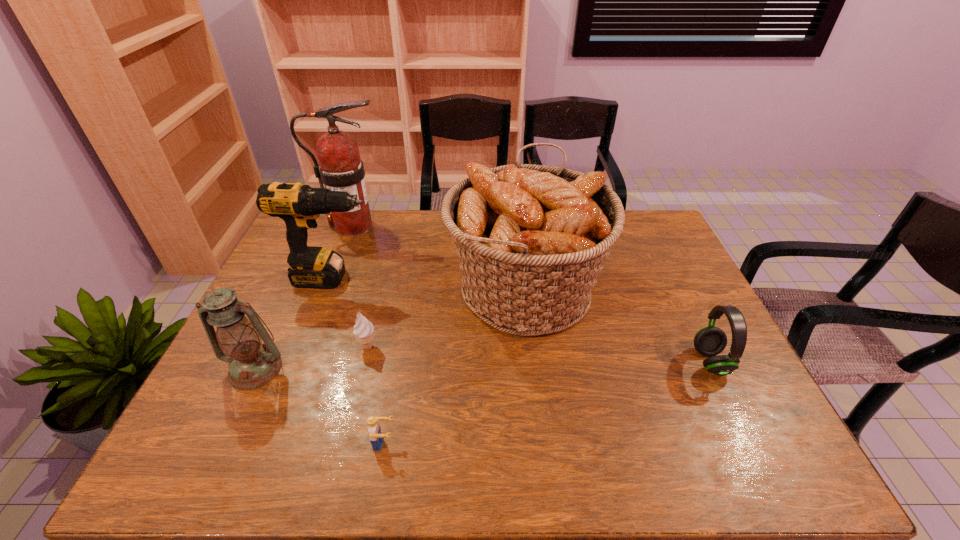
In order to click on basket at the far edge in this screenshot , I will do `click(531, 239)`.

Where is `object at the near edge`? object at the near edge is located at coordinates (376, 437).

Where is `fire extinguisher at the left edge`? The width and height of the screenshot is (960, 540). fire extinguisher at the left edge is located at coordinates (340, 168).

At what (x,y) coordinates should I click in order to perform the action: click on drill that is at the left edge. Please return your answer as a coordinate pair (x, y). Looking at the image, I should click on (299, 206).

Find the location of a particular element. oil lamp positioned at the left edge is located at coordinates (252, 364).

I want to click on object that is at the right edge, so click(710, 341).

Locate an element on the screen. Image resolution: width=960 pixels, height=540 pixels. object that is positioned at the far left corner is located at coordinates (340, 168).

Find the location of `free spot at the near edge of the desktop`. free spot at the near edge of the desktop is located at coordinates (349, 440).

This screenshot has height=540, width=960. In the image, there is a desktop. Identify the location of free space at the left edge. (276, 269).

The width and height of the screenshot is (960, 540). In the image, there is a desktop. Identify the location of vacant space at the right edge. (686, 317).